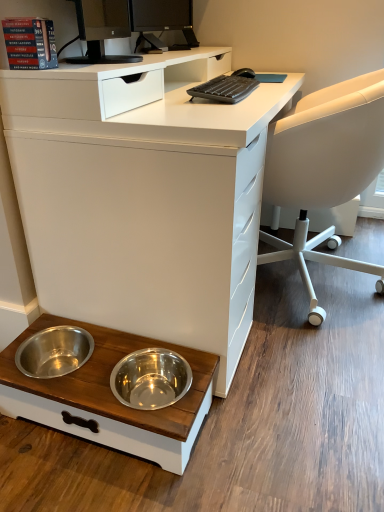
Image resolution: width=384 pixels, height=512 pixels. Identify the location of vacant area that is in front of wooden pet bowls at lower left. (92, 480).